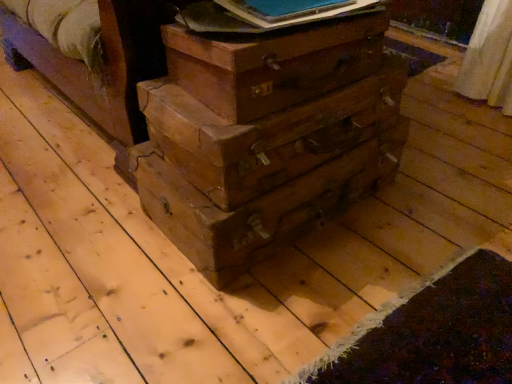
At what (x,y) coordinates should I click in order to perform the action: click on wooden suitcase at center. Please return your answer as a coordinate pair (x, y). Looking at the image, I should click on (273, 63).

I want to click on wooden drawer at center, which is the 1th drawer from top to bottom, so click(267, 134).

Starting from the blue paper at upper center, which drawer is the 1st one to the left? Please provide its 2D coordinates.

[(259, 205)]

From the image's perspective, which is below, wooden drawer at center, placed as the second drawer when sorted from top to bottom, or blue paper at upper center?

wooden drawer at center, placed as the second drawer when sorted from top to bottom, from the image's perspective.

Can you confirm if wooden drawer at center, which is counted as the 1th drawer, starting from the bottom, is bigger than blue paper at upper center?

Indeed, wooden drawer at center, which is counted as the 1th drawer, starting from the bottom, has a larger size compared to blue paper at upper center.

Which object is further away from the camera taking this photo, wooden drawer at center, which is counted as the 1th drawer, starting from the bottom, or blue paper at upper center?

blue paper at upper center is behind.

Is blue paper at upper center wider or thinner than wooden suitcase at center?

In the image, blue paper at upper center appears to be more narrow than wooden suitcase at center.

Which object is closer to the camera, blue paper at upper center or wooden suitcase at center?

wooden suitcase at center is in front.

Are blue paper at upper center and wooden suitcase at center far apart?

No, blue paper at upper center is in close proximity to wooden suitcase at center.

Could you tell me if wooden drawer at center, the second drawer positioned from the bottom, is turned towards wooden suitcase at center?

No, wooden drawer at center, the second drawer positioned from the bottom, does not turn towards wooden suitcase at center.

Which object is positioned more to the left, wooden drawer at center, which is the 1th drawer from top to bottom, or wooden suitcase at center?

From the viewer's perspective, wooden drawer at center, which is the 1th drawer from top to bottom, appears more on the left side.

Can you tell me how much wooden drawer at center, the second drawer positioned from the bottom, and wooden suitcase at center differ in facing direction?

3.94 degrees separate the facing orientations of wooden drawer at center, the second drawer positioned from the bottom, and wooden suitcase at center.

Is wooden drawer at center, the second drawer positioned from the bottom, surrounding blue paper at upper center?

No, blue paper at upper center is not inside wooden drawer at center, the second drawer positioned from the bottom.

Between wooden drawer at center, the second drawer positioned from the bottom, and blue paper at upper center, which one has larger width?

Wider between the two is wooden drawer at center, the second drawer positioned from the bottom.

Based on the photo, which object is further away from the camera taking this photo, wooden drawer at center, which is the 1th drawer from top to bottom, or blue paper at upper center?

blue paper at upper center is further away from the camera.

Find the location of `drawer that is the 1st object located below the blue paper at upper center (from the image's perspective)`. drawer that is the 1st object located below the blue paper at upper center (from the image's perspective) is located at coordinates (267, 134).

Does wooden suitcase at center appear on the left side of wooden drawer at center, placed as the second drawer when sorted from top to bottom?

No.

Could you measure the distance between wooden suitcase at center and wooden drawer at center, which is counted as the 1th drawer, starting from the bottom?

wooden suitcase at center is 25.82 centimeters away from wooden drawer at center, which is counted as the 1th drawer, starting from the bottom.

From the picture: Can you confirm if wooden suitcase at center is thinner than wooden drawer at center, placed as the second drawer when sorted from top to bottom?

Yes, wooden suitcase at center is thinner than wooden drawer at center, placed as the second drawer when sorted from top to bottom.

Is point (219, 99) positioned after point (281, 225)?

No.

In the image, is wooden drawer at center, which is the 1th drawer from top to bottom, positioned in front of or behind wooden drawer at center, placed as the second drawer when sorted from top to bottom?

wooden drawer at center, which is the 1th drawer from top to bottom, is positioned closer to the viewer than wooden drawer at center, placed as the second drawer when sorted from top to bottom.

Would you say wooden drawer at center, which is the 1th drawer from top to bottom, is a long distance from wooden drawer at center, placed as the second drawer when sorted from top to bottom?

They are positioned close to each other.

From a real-world perspective, who is located higher, wooden drawer at center, the second drawer positioned from the bottom, or wooden drawer at center, which is counted as the 1th drawer, starting from the bottom?

From a 3D spatial view, wooden drawer at center, the second drawer positioned from the bottom, is above.

Would you say wooden drawer at center, the second drawer positioned from the bottom, is inside or outside wooden drawer at center, which is counted as the 1th drawer, starting from the bottom?

wooden drawer at center, the second drawer positioned from the bottom, is located beyond the bounds of wooden drawer at center, which is counted as the 1th drawer, starting from the bottom.

Find the location of a particular element. The width and height of the screenshot is (512, 384). drawer in front of the wooden drawer at center, placed as the second drawer when sorted from top to bottom is located at coordinates [x=267, y=134].

Is wooden drawer at center, which is counted as the 1th drawer, starting from the bottom, in front of or behind wooden drawer at center, which is the 1th drawer from top to bottom, in the image?

Clearly, wooden drawer at center, which is counted as the 1th drawer, starting from the bottom, is behind wooden drawer at center, which is the 1th drawer from top to bottom.

Considering the sizes of wooden drawer at center, which is counted as the 1th drawer, starting from the bottom, and wooden drawer at center, the second drawer positioned from the bottom, in the image, is wooden drawer at center, which is counted as the 1th drawer, starting from the bottom, taller or shorter than wooden drawer at center, the second drawer positioned from the bottom,?

Considering their sizes, wooden drawer at center, which is counted as the 1th drawer, starting from the bottom, has less height than wooden drawer at center, the second drawer positioned from the bottom.

From the blue paper at upper center, count 1st drawers forward and point to it. Please provide its 2D coordinates.

[(259, 205)]

What are the coordinates of `paperback book behind the wooden suitcase at center` in the screenshot? It's located at (289, 10).

From the image, which object appears to be nearer to wooden suitcase at center, wooden drawer at center, which is counted as the 1th drawer, starting from the bottom, or blue paper at upper center?

Based on the image, blue paper at upper center appears to be nearer to wooden suitcase at center.

Considering their positions, is wooden drawer at center, which is the 1th drawer from top to bottom, positioned further to wooden suitcase at center than blue paper at upper center?

blue paper at upper center is further to wooden suitcase at center.

Which object lies nearer to the anchor point wooden drawer at center, the second drawer positioned from the bottom, wooden drawer at center, placed as the second drawer when sorted from top to bottom, or wooden suitcase at center?

The object closer to wooden drawer at center, the second drawer positioned from the bottom, is wooden suitcase at center.

Which object lies further to the anchor point blue paper at upper center, wooden drawer at center, the second drawer positioned from the bottom, or wooden drawer at center, placed as the second drawer when sorted from top to bottom?

wooden drawer at center, placed as the second drawer when sorted from top to bottom, lies further to blue paper at upper center than the other object.

From the image, which object appears to be farther from wooden drawer at center, which is counted as the 1th drawer, starting from the bottom, blue paper at upper center or wooden drawer at center, the second drawer positioned from the bottom?

blue paper at upper center is positioned further to the anchor wooden drawer at center, which is counted as the 1th drawer, starting from the bottom.

When comparing their distances from wooden drawer at center, the second drawer positioned from the bottom, does blue paper at upper center or wooden suitcase at center seem closer?

Answer: The object closer to wooden drawer at center, the second drawer positioned from the bottom, is wooden suitcase at center.

When comparing their distances from wooden drawer at center, placed as the second drawer when sorted from top to bottom, does blue paper at upper center or wooden suitcase at center seem further?

blue paper at upper center is positioned further to the anchor wooden drawer at center, placed as the second drawer when sorted from top to bottom.

When comparing their distances from blue paper at upper center, does wooden suitcase at center or wooden drawer at center, placed as the second drawer when sorted from top to bottom, seem further?

Among the two, wooden drawer at center, placed as the second drawer when sorted from top to bottom, is located further to blue paper at upper center.

Image resolution: width=512 pixels, height=384 pixels. In order to click on crate that lies between blue paper at upper center and wooden drawer at center, placed as the second drawer when sorted from top to bottom, from top to bottom in this screenshot , I will do `click(273, 63)`.

This screenshot has width=512, height=384. I want to click on drawer between blue paper at upper center and wooden drawer at center, placed as the second drawer when sorted from top to bottom, from top to bottom, so [267, 134].

This screenshot has height=384, width=512. Find the location of `crate that lies between blue paper at upper center and wooden drawer at center, which is the 1th drawer from top to bottom, from top to bottom`. crate that lies between blue paper at upper center and wooden drawer at center, which is the 1th drawer from top to bottom, from top to bottom is located at coordinates (273, 63).

Identify the location of drawer between wooden suitcase at center and wooden drawer at center, placed as the second drawer when sorted from top to bottom, in the vertical direction. (267, 134).